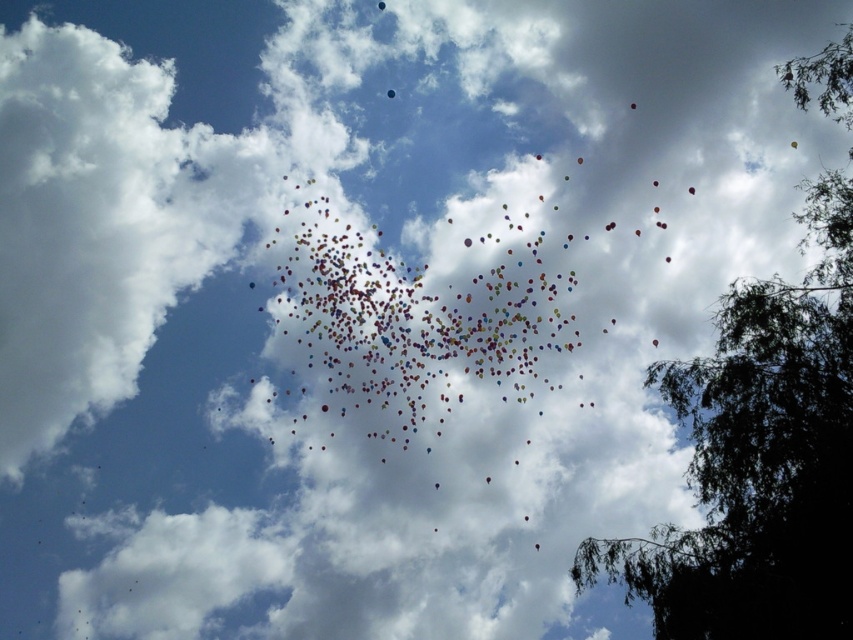
You are standing at the bottom of the image and looking up at the scene. There is a point marked at coordinates (759, 460). What object is this point located on?

The point at (759, 460) is located on the green leafy tree at upper right.

You are a photographer trying to capture the green leafy tree at upper right and the translucent glossy balloon at upper center in the same frame. Which object appears wider in the photo?

The green leafy tree at upper right appears wider than the translucent glossy balloon at upper center because its width surpasses the balloon.